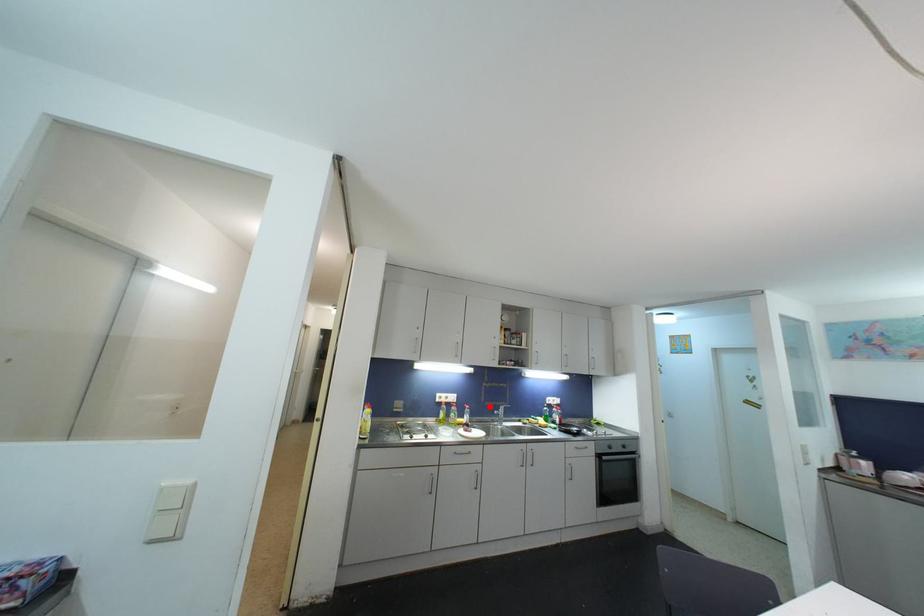
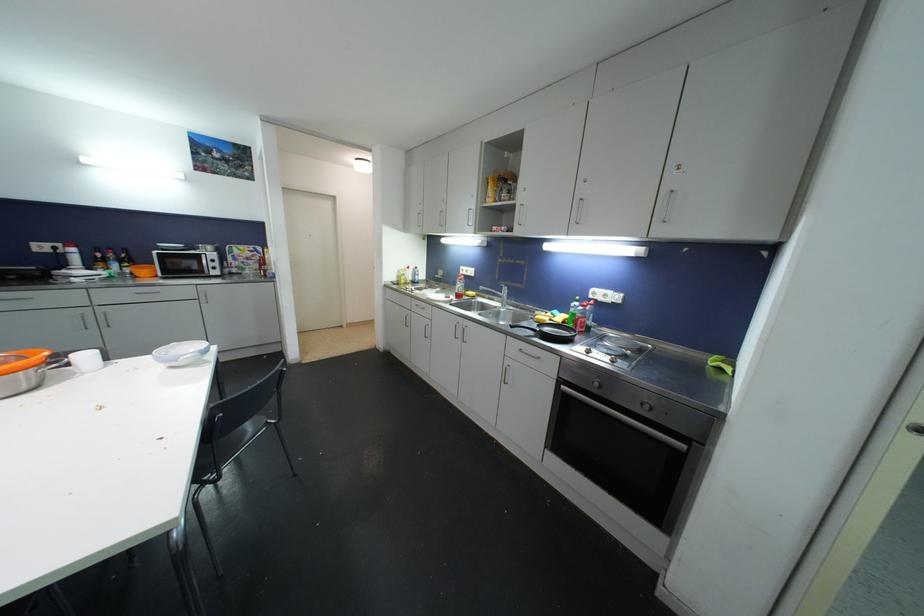
In the second image, find the point that corresponds to the highlighted location in the first image.

(504, 285)